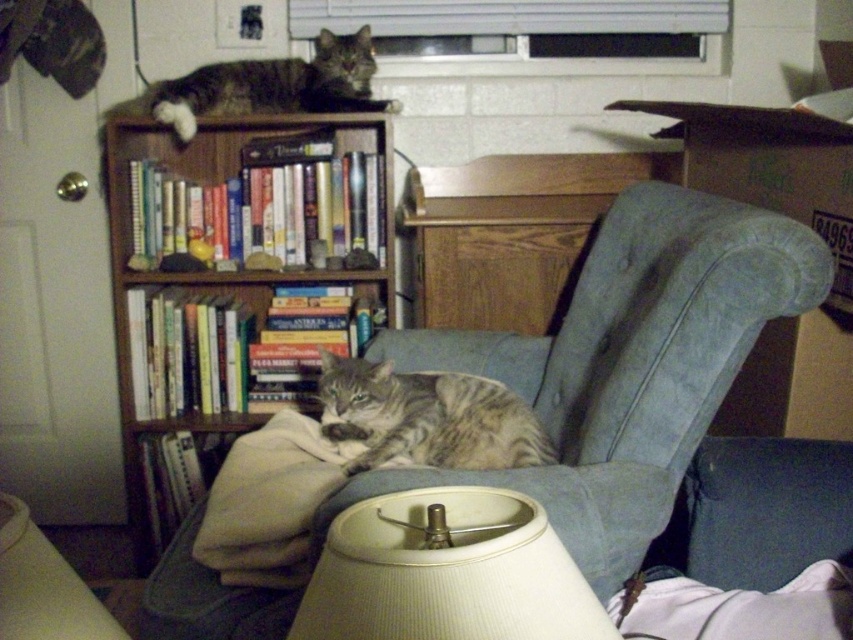
Question: Does wooden bookshelf at upper left appear over tabby fur cat at upper left?

Choices:
 (A) no
 (B) yes

Answer: (A)

Question: Which object is positioned farthest from the tabby fur cat at center?

Choices:
 (A) velvet blue armchair at center
 (B) beige ribbed lampshade at lower center
 (C) tabby fur cat at upper left

Answer: (C)

Question: Which of these objects is positioned closest to the tabby fur cat at center?

Choices:
 (A) velvet blue armchair at center
 (B) tabby fur cat at upper left
 (C) wooden bookshelf at upper left

Answer: (A)

Question: Among these points, which one is farthest from the camera?

Choices:
 (A) (605, 440)
 (B) (355, 522)

Answer: (A)

Question: Does wooden bookshelf at upper left lie behind tabby fur cat at upper left?

Choices:
 (A) no
 (B) yes

Answer: (B)

Question: Does wooden bookshelf at upper left have a smaller size compared to tabby fur cat at center?

Choices:
 (A) no
 (B) yes

Answer: (A)